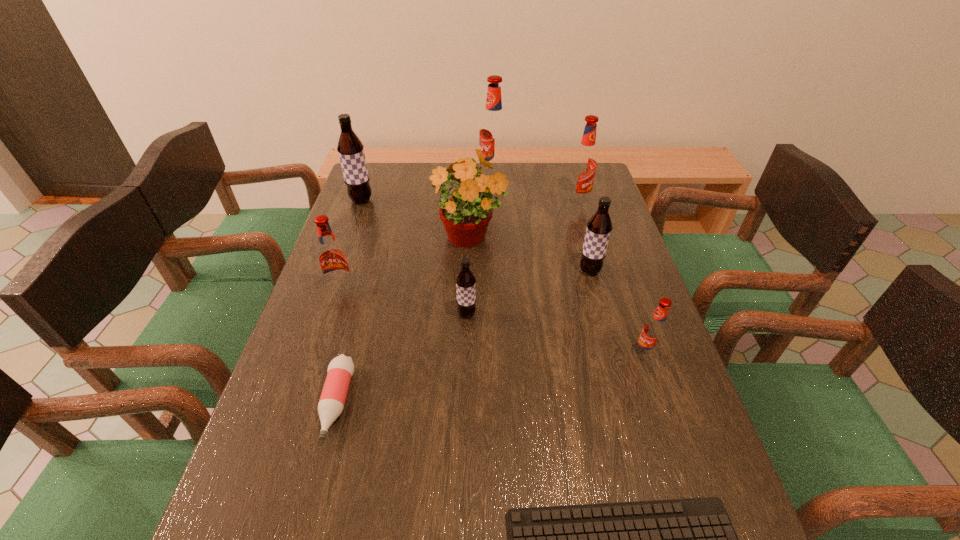
Image resolution: width=960 pixels, height=540 pixels. In order to click on the farthest root beer in this screenshot , I will do `click(493, 135)`.

Identify the location of the second red root beer from left to right. Image resolution: width=960 pixels, height=540 pixels. (493, 135).

Where is `the farthest brown root beer`? This screenshot has height=540, width=960. the farthest brown root beer is located at coordinates (x=351, y=153).

Where is `the biggest brown root beer`? the biggest brown root beer is located at coordinates (351, 153).

Where is `the third smallest red root beer`? the third smallest red root beer is located at coordinates (583, 167).

This screenshot has height=540, width=960. What are the coordinates of `flowerpot` in the screenshot? It's located at (466, 215).

This screenshot has height=540, width=960. What are the coordinates of `the second biggest brown root beer` in the screenshot? It's located at (599, 227).

The height and width of the screenshot is (540, 960). What are the coordinates of `the rightmost brown root beer` in the screenshot? It's located at (599, 227).

Where is `the fifth nearest object`? the fifth nearest object is located at coordinates (332, 258).

Find the location of a particular element. Image resolution: width=960 pixels, height=540 pixels. the fifth farthest root beer is located at coordinates (332, 258).